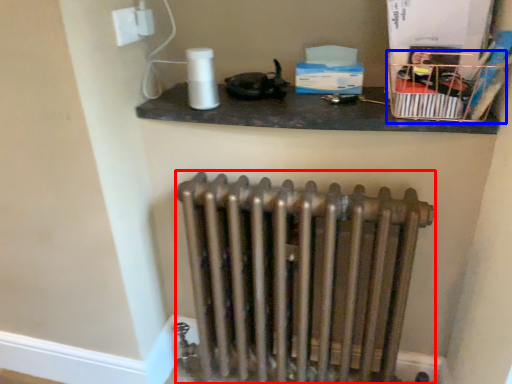
Question: Which of the following is the farthest to the observer, radiator (highlighted by a red box) or crate (highlighted by a blue box)?

Choices:
 (A) radiator
 (B) crate

Answer: (A)